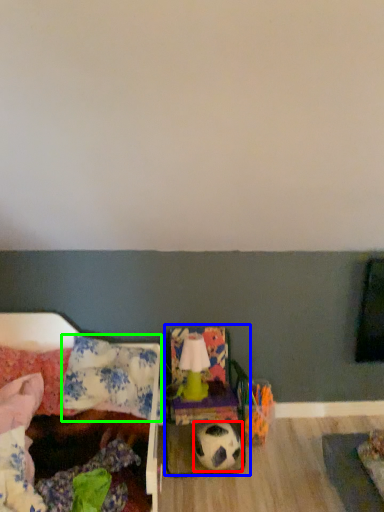
Question: Considering the real-world distances, which object is closest to football (highlighted by a red box)? armchair (highlighted by a blue box) or pillow (highlighted by a green box).

Choices:
 (A) armchair
 (B) pillow

Answer: (A)